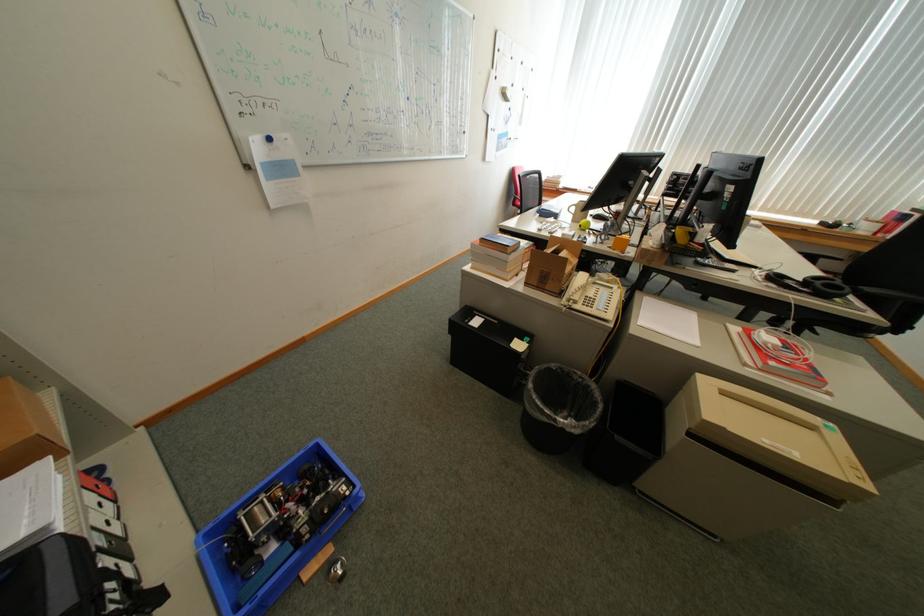
Where is `red binder spine`? Image resolution: width=924 pixels, height=616 pixels. red binder spine is located at coordinates (781, 362).